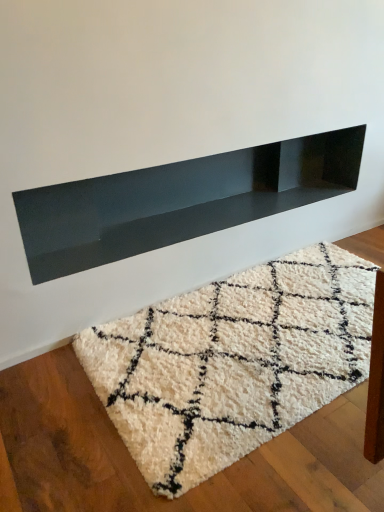
Question: Should I look upward or downward to see white shaggy rug at center?

Choices:
 (A) up
 (B) down

Answer: (B)

Question: Is glossy black shelf at upper center a part of white shaggy rug at center?

Choices:
 (A) no
 (B) yes

Answer: (A)

Question: Does white shaggy rug at center have a smaller size compared to glossy black shelf at upper center?

Choices:
 (A) yes
 (B) no

Answer: (A)

Question: Is white shaggy rug at center looking in the opposite direction of glossy black shelf at upper center?

Choices:
 (A) no
 (B) yes

Answer: (A)

Question: Is white shaggy rug at center facing towards glossy black shelf at upper center?

Choices:
 (A) no
 (B) yes

Answer: (A)

Question: Considering the relative sizes of white shaggy rug at center and glossy black shelf at upper center in the image provided, is white shaggy rug at center bigger than glossy black shelf at upper center?

Choices:
 (A) no
 (B) yes

Answer: (A)

Question: Is white shaggy rug at center positioned beyond the bounds of glossy black shelf at upper center?

Choices:
 (A) no
 (B) yes

Answer: (B)

Question: Is glossy black shelf at upper center oriented away from white shaggy rug at center?

Choices:
 (A) yes
 (B) no

Answer: (B)

Question: Can you confirm if glossy black shelf at upper center is wider than white shaggy rug at center?

Choices:
 (A) no
 (B) yes

Answer: (A)

Question: Is the position of glossy black shelf at upper center less distant than that of white shaggy rug at center?

Choices:
 (A) no
 (B) yes

Answer: (A)

Question: Can you confirm if glossy black shelf at upper center is thinner than white shaggy rug at center?

Choices:
 (A) yes
 (B) no

Answer: (A)

Question: Is glossy black shelf at upper center behind white shaggy rug at center?

Choices:
 (A) no
 (B) yes

Answer: (B)

Question: Are glossy black shelf at upper center and white shaggy rug at center far apart?

Choices:
 (A) no
 (B) yes

Answer: (A)

Question: In terms of height, does white shaggy rug at center look taller or shorter compared to glossy black shelf at upper center?

Choices:
 (A) short
 (B) tall

Answer: (A)